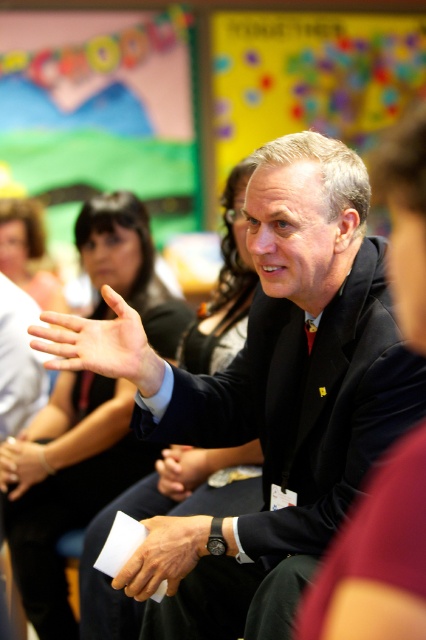
Is black matte suit at center above smooth skin hand at center?

Actually, black matte suit at center is below smooth skin hand at center.

This screenshot has width=426, height=640. I want to click on black matte suit at center, so click(291, 380).

Is point (167, 598) closer to camera compared to point (40, 320)?

No, (167, 598) is behind (40, 320).

The image size is (426, 640). Identify the location of black matte suit at center. (291, 380).

Is point (388, 378) more distant than point (207, 454)?

No, (388, 378) is closer to viewer.

The image size is (426, 640). Describe the element at coordinates (291, 380) in the screenshot. I see `black matte suit at center` at that location.

What do you see at coordinates (291, 380) in the screenshot? I see `black matte suit at center` at bounding box center [291, 380].

Locate an element on the screen. Image resolution: width=426 pixels, height=640 pixels. black matte suit at center is located at coordinates (291, 380).

Does black matte suit at center have a larger size compared to white paper at center?

Correct, black matte suit at center is larger in size than white paper at center.

Between black matte suit at center and white paper at center, which one appears on the left side from the viewer's perspective?

From the viewer's perspective, white paper at center appears more on the left side.

The image size is (426, 640). I want to click on black matte suit at center, so click(291, 380).

Identify the location of black matte suit at center. (291, 380).